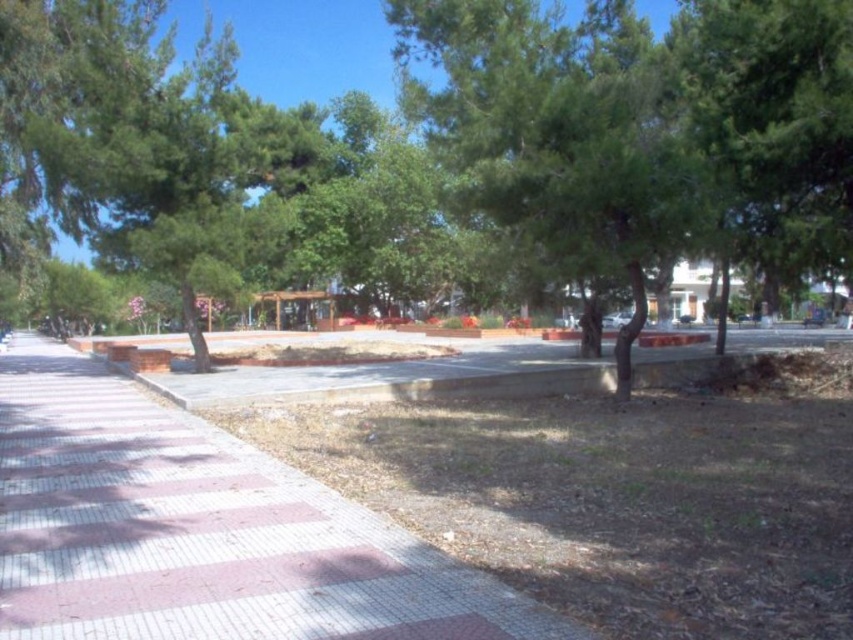
You are standing on the red brick pavement at left and looking towards the green leafy tree at left. Which object is taller?

The green leafy tree at left is taller than the red brick pavement at left.

You are standing at the starting point of the paved pathway in the park. A treasure is buried at the point marked by coordinates point (641, 275). If you walk straight ahead along the path, will you reach the treasure before walking 15 meters?

The point (641, 275) is 14.34 meters away from the viewer. Since 14.34 meters is less than 15 meters, walking straight ahead along the path will allow you to reach the treasure before walking 15 meters.

You are a hiker who wants to take a photo of the green leafy tree at center and the green leafy tree at left. From your current position, which tree is closer to you?

The green leafy tree at center is closer to you because it is in front of the green leafy tree at left.